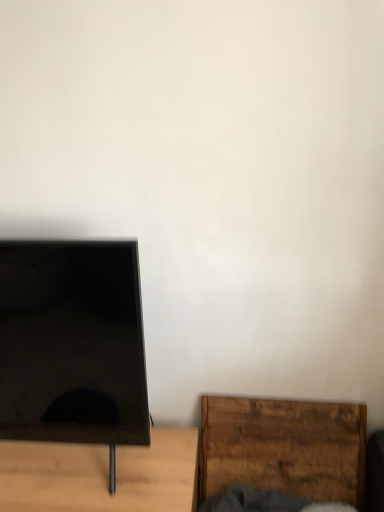
This screenshot has height=512, width=384. In order to click on wooden cutting board at lower right, the 2th furniture viewed from the left in this screenshot , I will do click(x=283, y=447).

Measure the distance between wooden cutting board at lower right, the 2th furniture viewed from the left, and black matte tv stand at left, positioned as the 2th furniture in right-to-left order.

33.02 centimeters.

From a real-world perspective, which is physically below, wooden cutting board at lower right, the 2th furniture viewed from the left, or black matte tv stand at left, the first furniture viewed from the left?

In real-world perspective, black matte tv stand at left, the first furniture viewed from the left, is lower.

Is wooden cutting board at lower right, the 2th furniture viewed from the left, positioned behind black matte tv stand at left, the first furniture viewed from the left?

Yes, wooden cutting board at lower right, the 2th furniture viewed from the left, is further from the camera.

Identify the location of furniture that is under the wooden cutting board at lower right, positioned as the first furniture in right-to-left order (from a real-world perspective). This screenshot has height=512, width=384. (101, 475).

Is black glossy screen at left facing away from black matte tv stand at left, positioned as the 2th furniture in right-to-left order?

No, black glossy screen at left is not facing away from black matte tv stand at left, positioned as the 2th furniture in right-to-left order.

From a real-world perspective, between black glossy screen at left and black matte tv stand at left, the first furniture viewed from the left, who is vertically lower?

black matte tv stand at left, the first furniture viewed from the left, is physically lower.

What are the coordinates of `screen above the black matte tv stand at left, the first furniture viewed from the left (from the image's perspective)` in the screenshot? It's located at (71, 341).

Is black glossy screen at left positioned beyond the bounds of black matte tv stand at left, positioned as the 2th furniture in right-to-left order?

Yes.

Based on the photo, could you tell me if wooden cutting board at lower right, positioned as the first furniture in right-to-left order, is facing black glossy screen at left?

No, wooden cutting board at lower right, positioned as the first furniture in right-to-left order, is not aimed at black glossy screen at left.

From a real-world perspective, is wooden cutting board at lower right, the 2th furniture viewed from the left, beneath black glossy screen at left?

Yes.

What's the angular difference between wooden cutting board at lower right, the 2th furniture viewed from the left, and black glossy screen at left's facing directions?

The angle between the facing direction of wooden cutting board at lower right, the 2th furniture viewed from the left, and the facing direction of black glossy screen at left is 0.964 degrees.

From the image's perspective, is wooden cutting board at lower right, the 2th furniture viewed from the left, above or below black glossy screen at left?

Based on their image positions, wooden cutting board at lower right, the 2th furniture viewed from the left, is located beneath black glossy screen at left.

Between black matte tv stand at left, positioned as the 2th furniture in right-to-left order, and black glossy screen at left, which one is positioned behind?

black matte tv stand at left, positioned as the 2th furniture in right-to-left order, is further away from the camera.

Considering the sizes of objects black matte tv stand at left, the first furniture viewed from the left, and black glossy screen at left in the image provided, who is thinner, black matte tv stand at left, the first furniture viewed from the left, or black glossy screen at left?

With smaller width is black glossy screen at left.

Would you consider black matte tv stand at left, positioned as the 2th furniture in right-to-left order, to be distant from black glossy screen at left?

black matte tv stand at left, positioned as the 2th furniture in right-to-left order, is actually quite close to black glossy screen at left.

Is point (135, 461) closer to camera compared to point (137, 315)?

That is False.

Which of these two, black glossy screen at left or wooden cutting board at lower right, positioned as the first furniture in right-to-left order, stands shorter?

Standing shorter between the two is wooden cutting board at lower right, positioned as the first furniture in right-to-left order.

From a real-world perspective, is black glossy screen at left positioned over wooden cutting board at lower right, positioned as the first furniture in right-to-left order, based on gravity?

Yes, from a real-world perspective, black glossy screen at left is on top of wooden cutting board at lower right, positioned as the first furniture in right-to-left order.

Considering the sizes of objects black glossy screen at left and wooden cutting board at lower right, positioned as the first furniture in right-to-left order, in the image provided, who is smaller, black glossy screen at left or wooden cutting board at lower right, positioned as the first furniture in right-to-left order,?

Smaller between the two is wooden cutting board at lower right, positioned as the first furniture in right-to-left order.

Find the location of `furniture that is the 1st object located below the black glossy screen at left (from the image's perspective)`. furniture that is the 1st object located below the black glossy screen at left (from the image's perspective) is located at coordinates (283, 447).

How much distance is there between black matte tv stand at left, positioned as the 2th furniture in right-to-left order, and wooden cutting board at lower right, the 2th furniture viewed from the left?

They are 13.00 inches apart.

Is black matte tv stand at left, the first furniture viewed from the left, looking in the opposite direction of wooden cutting board at lower right, positioned as the first furniture in right-to-left order?

That's not correct — black matte tv stand at left, the first furniture viewed from the left, is not looking away from wooden cutting board at lower right, positioned as the first furniture in right-to-left order.

What's the angular difference between black matte tv stand at left, the first furniture viewed from the left, and wooden cutting board at lower right, the 2th furniture viewed from the left,'s facing directions?

They differ by 0.916 degrees in their facing directions.

Which is correct: black matte tv stand at left, positioned as the 2th furniture in right-to-left order, is inside wooden cutting board at lower right, positioned as the first furniture in right-to-left order, or outside of it?

black matte tv stand at left, positioned as the 2th furniture in right-to-left order, is not inside wooden cutting board at lower right, positioned as the first furniture in right-to-left order, it's outside.

At what (x,y) coordinates should I click in order to perform the action: click on furniture lying on the right of black matte tv stand at left, the first furniture viewed from the left. Please return your answer as a coordinate pair (x, y). Image resolution: width=384 pixels, height=512 pixels. Looking at the image, I should click on (283, 447).

This screenshot has height=512, width=384. There is a black matte tv stand at left, the first furniture viewed from the left. In order to click on screen above it (from a real-world perspective) in this screenshot , I will do `click(71, 341)`.

When comparing their distances from wooden cutting board at lower right, positioned as the first furniture in right-to-left order, does black glossy screen at left or black matte tv stand at left, the first furniture viewed from the left, seem closer?

black matte tv stand at left, the first furniture viewed from the left, is positioned closer to the anchor wooden cutting board at lower right, positioned as the first furniture in right-to-left order.

From the image, which object appears to be nearer to black glossy screen at left, black matte tv stand at left, the first furniture viewed from the left, or wooden cutting board at lower right, the 2th furniture viewed from the left?

black matte tv stand at left, the first furniture viewed from the left, is positioned closer to the anchor black glossy screen at left.

From the image, which object appears to be farther from wooden cutting board at lower right, positioned as the first furniture in right-to-left order, black matte tv stand at left, the first furniture viewed from the left, or black glossy screen at left?

Based on the image, black glossy screen at left appears to be further to wooden cutting board at lower right, positioned as the first furniture in right-to-left order.

When comparing their distances from black matte tv stand at left, the first furniture viewed from the left, does wooden cutting board at lower right, the 2th furniture viewed from the left, or black glossy screen at left seem closer?

Based on the image, black glossy screen at left appears to be nearer to black matte tv stand at left, the first furniture viewed from the left.

Looking at the image, which one is located closer to black matte tv stand at left, positioned as the 2th furniture in right-to-left order, black glossy screen at left or wooden cutting board at lower right, positioned as the first furniture in right-to-left order?

Based on the image, black glossy screen at left appears to be nearer to black matte tv stand at left, positioned as the 2th furniture in right-to-left order.

Which object lies further to the anchor point black glossy screen at left, wooden cutting board at lower right, positioned as the first furniture in right-to-left order, or black matte tv stand at left, positioned as the 2th furniture in right-to-left order?

wooden cutting board at lower right, positioned as the first furniture in right-to-left order.

Locate an element on the screen. This screenshot has height=512, width=384. furniture between black glossy screen at left and wooden cutting board at lower right, the 2th furniture viewed from the left, in the horizontal direction is located at coordinates (101, 475).